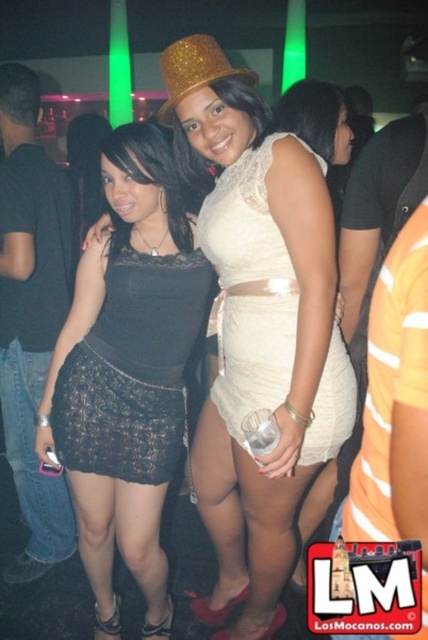
Question: Is black lace skirt at left positioned in front of matte white dress at center?

Choices:
 (A) no
 (B) yes

Answer: (B)

Question: Which point appears farthest from the camera in this image?

Choices:
 (A) tap(341, 340)
 (B) tap(196, 301)
 (C) tap(166, 406)
 (D) tap(333, 230)

Answer: (C)

Question: Can you confirm if black lace skirt at center is thinner than beige lace dress at center?

Choices:
 (A) yes
 (B) no

Answer: (B)

Question: Which of the following is the farthest from the observer?

Choices:
 (A) lace fabric dress at center
 (B) beige lace dress at center
 (C) black lace skirt at left

Answer: (C)

Question: Is black lace skirt at center thinner than black lace skirt at left?

Choices:
 (A) no
 (B) yes

Answer: (A)

Question: Based on their relative distances, which object is nearer to the matte white dress at center?

Choices:
 (A) lace fabric dress at center
 (B) black lace skirt at center

Answer: (A)